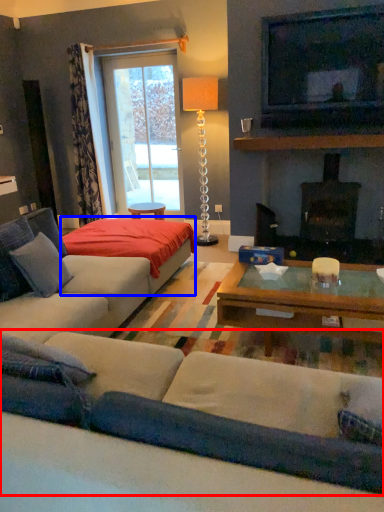
Question: Which object is further to the camera taking this photo, studio couch (highlighted by a red box) or plain (highlighted by a blue box)?

Choices:
 (A) studio couch
 (B) plain

Answer: (B)